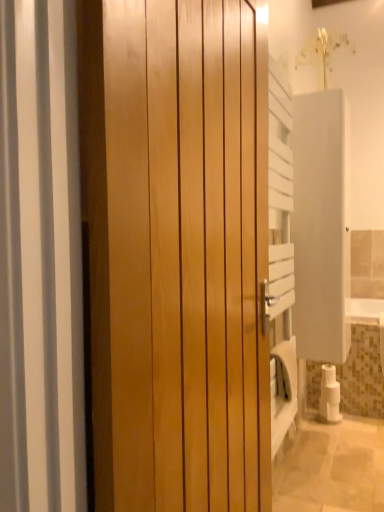
Question: Does glossy wood door at center have a greater width compared to white matte toilet paper at lower right?

Choices:
 (A) yes
 (B) no

Answer: (A)

Question: From a real-world perspective, is glossy wood door at center located beneath white matte toilet paper at lower right?

Choices:
 (A) no
 (B) yes

Answer: (A)

Question: Is glossy wood door at center oriented towards white matte toilet paper at lower right?

Choices:
 (A) yes
 (B) no

Answer: (B)

Question: From the image's perspective, does glossy wood door at center appear higher than white matte toilet paper at lower right?

Choices:
 (A) no
 (B) yes

Answer: (B)

Question: Can you confirm if glossy wood door at center is shorter than white matte toilet paper at lower right?

Choices:
 (A) no
 (B) yes

Answer: (A)

Question: Can you confirm if glossy wood door at center is bigger than white matte toilet paper at lower right?

Choices:
 (A) no
 (B) yes

Answer: (B)

Question: Would you say glossy wood door at center is outside white matte screen door at right?

Choices:
 (A) yes
 (B) no

Answer: (A)

Question: Does glossy wood door at center have a larger size compared to white matte screen door at right?

Choices:
 (A) yes
 (B) no

Answer: (A)

Question: Does glossy wood door at center have a lesser height compared to white matte screen door at right?

Choices:
 (A) yes
 (B) no

Answer: (B)

Question: Is the position of glossy wood door at center more distant than that of white matte screen door at right?

Choices:
 (A) yes
 (B) no

Answer: (B)

Question: Is white matte screen door at right a part of glossy wood door at center?

Choices:
 (A) yes
 (B) no

Answer: (B)

Question: Is glossy wood door at center next to white matte screen door at right?

Choices:
 (A) yes
 (B) no

Answer: (B)

Question: Can you confirm if white matte toilet paper at lower right is shorter than white matte screen door at right?

Choices:
 (A) yes
 (B) no

Answer: (A)